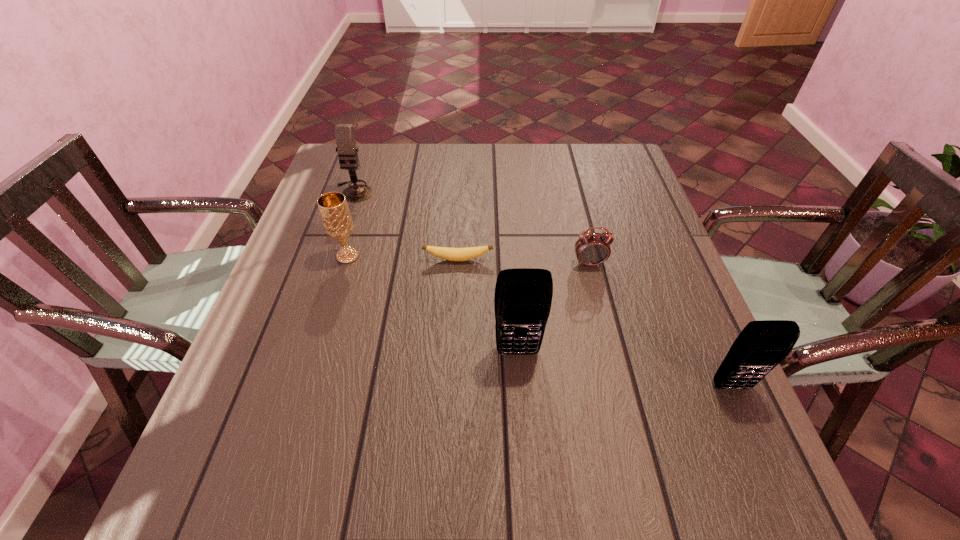
Where is `alarm clock positioned at the right edge`? alarm clock positioned at the right edge is located at coordinates (591, 249).

I want to click on object located in the far left corner section of the desktop, so click(x=344, y=133).

Identify the location of object that is at the near right corner. (762, 345).

At what (x,y) coordinates should I click in order to perform the action: click on free space at the far edge of the desktop. Please return your answer as a coordinate pair (x, y). Looking at the image, I should click on (521, 154).

Where is `blank space at the near edge of the desktop`? The height and width of the screenshot is (540, 960). blank space at the near edge of the desktop is located at coordinates (489, 431).

Identify the location of vacant space at the left edge. (307, 315).

In the image, there is a desktop. Where is `free space at the right edge`? free space at the right edge is located at coordinates (619, 194).

Where is `vacant area that lies between the microphone and the shortest object`? The width and height of the screenshot is (960, 540). vacant area that lies between the microphone and the shortest object is located at coordinates (406, 225).

Image resolution: width=960 pixels, height=540 pixels. Identify the location of vacant area that lies between the left cellular telephone and the fifth tallest object. (554, 308).

The image size is (960, 540). I want to click on vacant area between the taller cellular telephone and the shorter cellular telephone, so click(x=625, y=369).